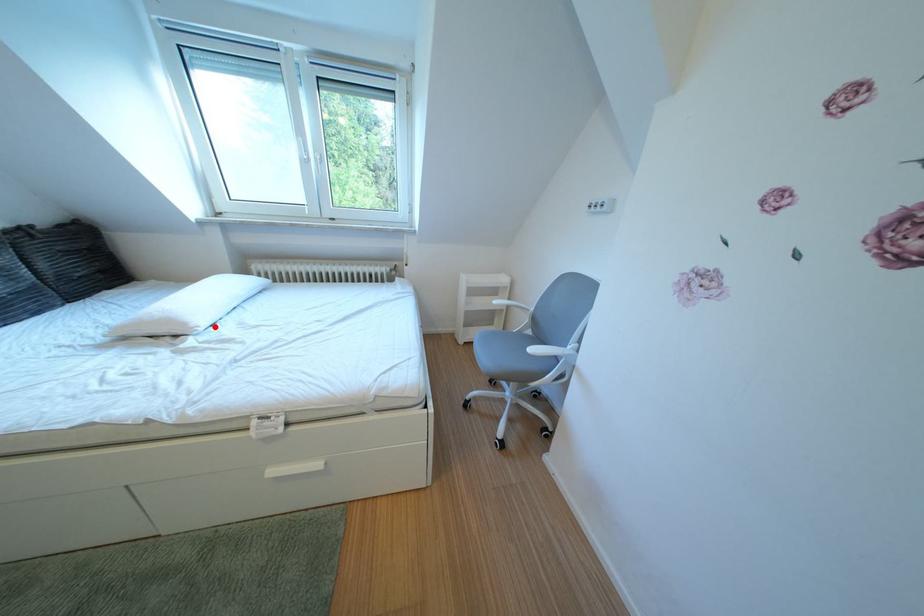
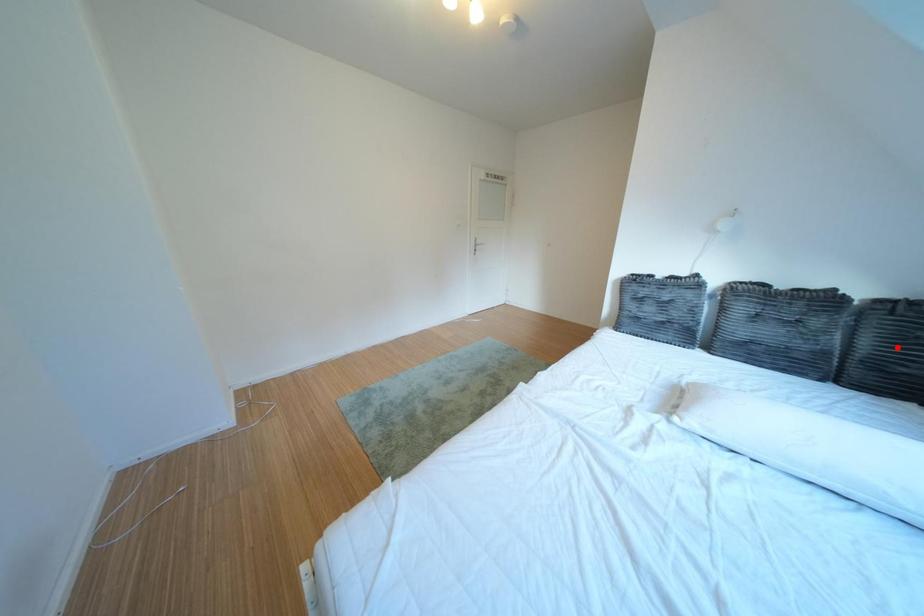
I am providing you with two images of the same scene from different viewpoints. A red point is marked on the first image and another point is marked on the second image. Are the points marked in image1 and image2 representing the same 3D position?

No